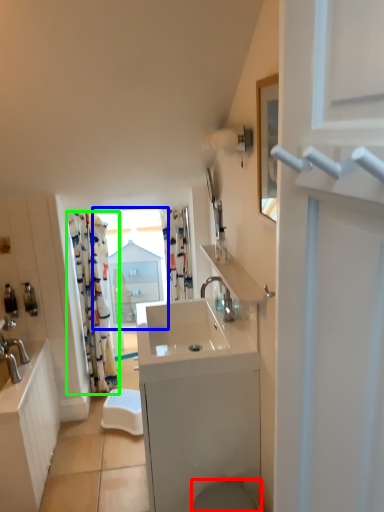
Question: Which object is positioned farthest from toilet bowl (highlighted by a red box)? Select from window (highlighted by a blue box) and curtain (highlighted by a green box).

Choices:
 (A) window
 (B) curtain

Answer: (A)